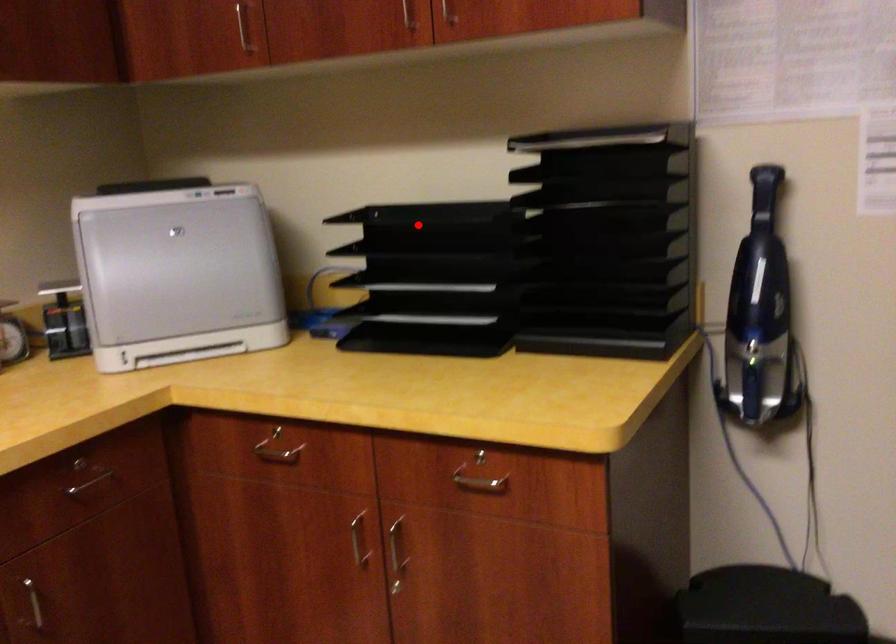
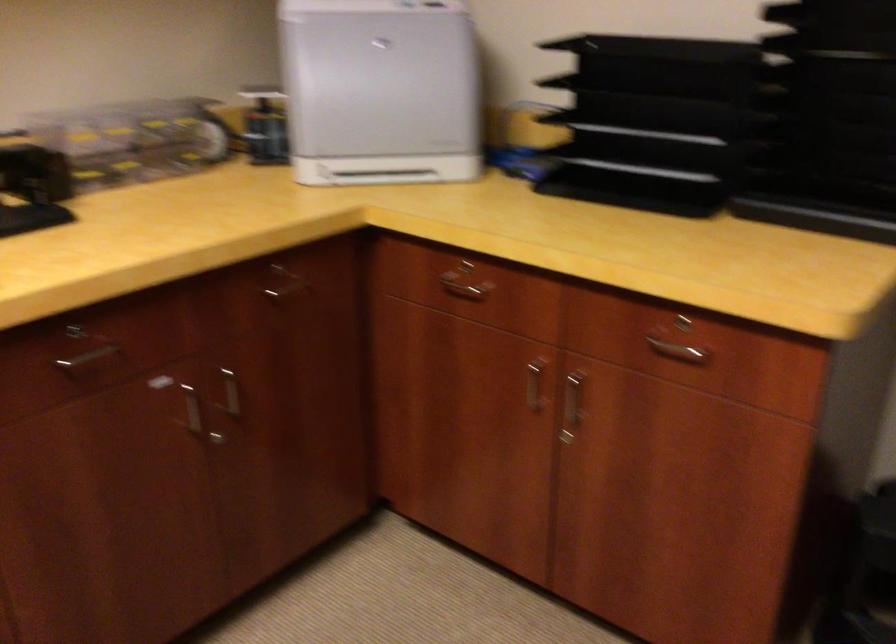
Where in the second image is the point corresponding to the highlighted location from the first image?

(640, 62)